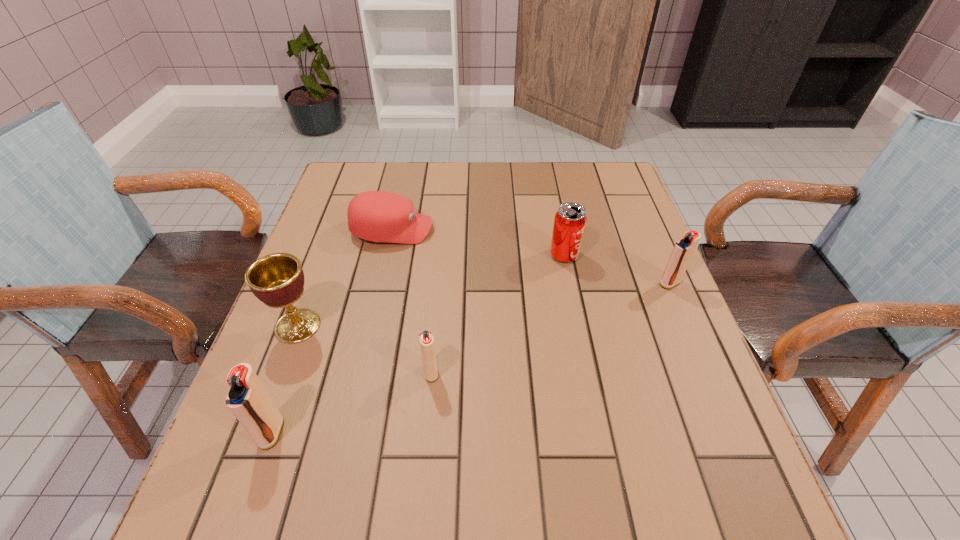
Where is `vacant region located on the right of the fifth farthest object`? Image resolution: width=960 pixels, height=540 pixels. vacant region located on the right of the fifth farthest object is located at coordinates (601, 373).

Find the location of a particular element. Image resolution: width=960 pixels, height=540 pixels. blank space located on the back of the rightmost igniter is located at coordinates (636, 203).

Where is `vacant space located on the front-facing side of the cap`? vacant space located on the front-facing side of the cap is located at coordinates (575, 230).

The image size is (960, 540). In order to click on vacant area situated on the right of the chalice in this screenshot , I will do `click(368, 326)`.

Find the location of a particular element. The width and height of the screenshot is (960, 540). vacant region located on the back of the fifth object from left to right is located at coordinates (552, 193).

At what (x,y) coordinates should I click in order to perform the action: click on object that is at the near edge. Please return your answer as a coordinate pair (x, y). The image size is (960, 540). Looking at the image, I should click on (248, 400).

Image resolution: width=960 pixels, height=540 pixels. Identify the location of igniter located in the left edge section of the desktop. (248, 400).

The width and height of the screenshot is (960, 540). Find the location of `cap positioned at the left edge`. cap positioned at the left edge is located at coordinates (377, 216).

Locate an element on the screen. The height and width of the screenshot is (540, 960). chalice situated at the left edge is located at coordinates (277, 280).

What are the coordinates of `object situated at the right edge` in the screenshot? It's located at (682, 253).